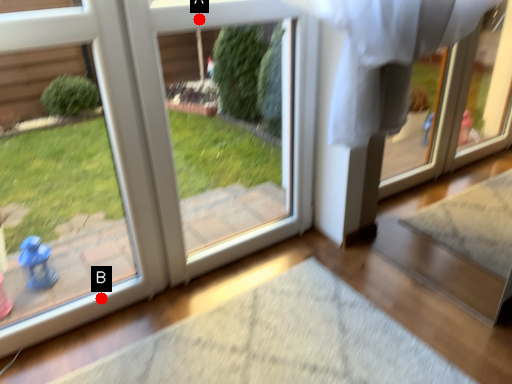
Question: Two points are circled on the image, labeled by A and B beside each circle. Which of the following is the closest to the observer?

Choices:
 (A) A is closer
 (B) B is closer

Answer: (A)